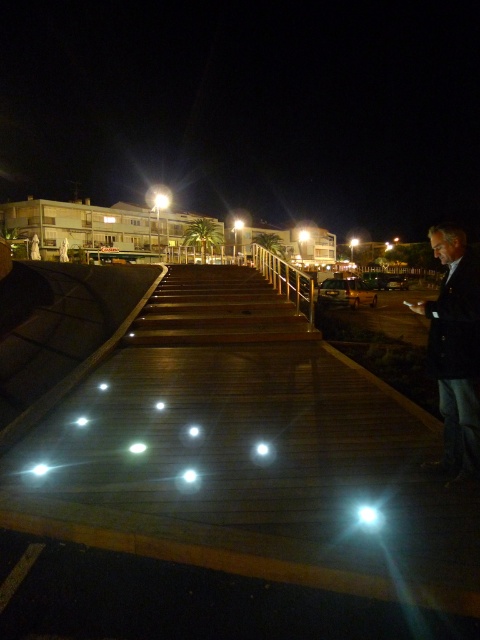
Question: Which point is farther from the camera taking this photo?

Choices:
 (A) (297, 308)
 (B) (444, 346)

Answer: (A)

Question: Which object appears farthest from the camera in this image?

Choices:
 (A) dark blue jacket at right
 (B) gold metallic railing at center

Answer: (B)

Question: Among these points, which one is nearest to the camera?

Choices:
 (A) (290, 284)
 (B) (471, 412)

Answer: (B)

Question: Is dark blue jacket at right wider than gold metallic railing at center?

Choices:
 (A) yes
 (B) no

Answer: (A)

Question: Does dark blue jacket at right appear on the left side of gold metallic railing at center?

Choices:
 (A) yes
 (B) no

Answer: (B)

Question: Is the position of dark blue jacket at right less distant than that of gold metallic railing at center?

Choices:
 (A) no
 (B) yes

Answer: (B)